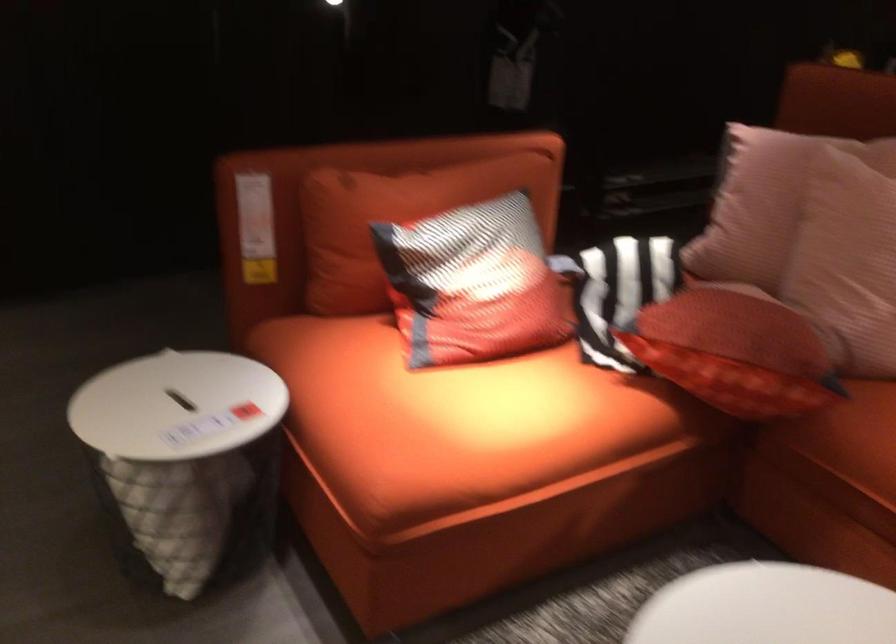
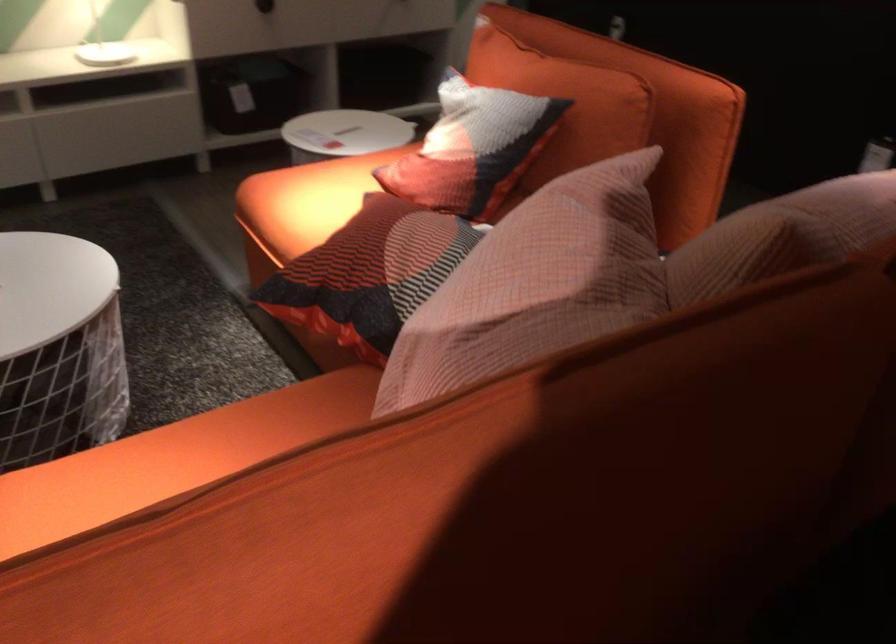
Locate, in the second image, the point that corresponds to point (541, 261) in the first image.

(472, 147)